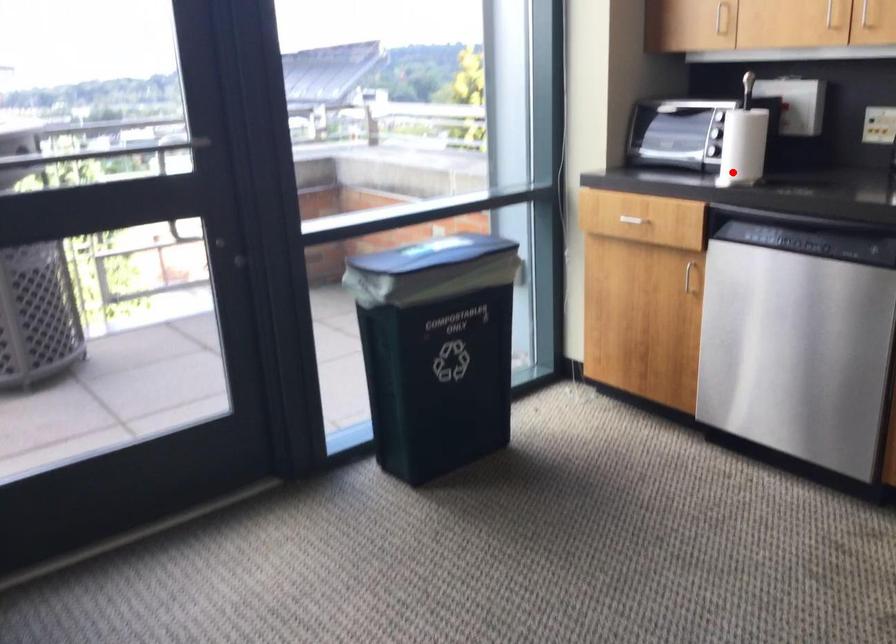
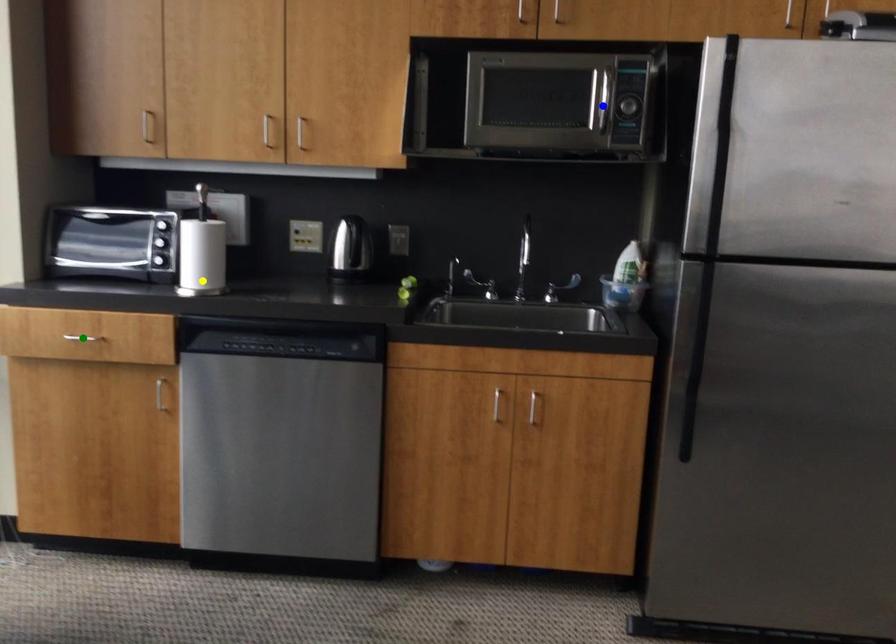
Question: I am providing you with two images of the same scene from different viewpoints. A red point is marked on the first image. You are given multiple points on the second image. Can you choose the point in image 2 that corresponds to the point in image 1?

Choices:
 (A) green point
 (B) blue point
 (C) yellow point

Answer: (C)